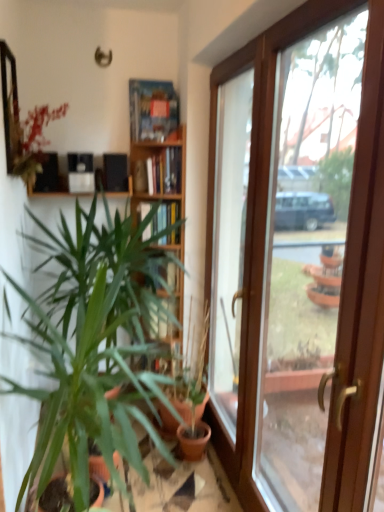
Question: Is matte black shelf at upper left closer to camera compared to clear glass door at center?

Choices:
 (A) no
 (B) yes

Answer: (A)

Question: Is matte black shelf at upper left with clear glass door at center?

Choices:
 (A) yes
 (B) no

Answer: (B)

Question: From the image's perspective, is matte black shelf at upper left beneath clear glass door at center?

Choices:
 (A) yes
 (B) no

Answer: (B)

Question: Can clear glass door at center be found inside matte black shelf at upper left?

Choices:
 (A) yes
 (B) no

Answer: (B)

Question: Is clear glass door at center at the back of matte black shelf at upper left?

Choices:
 (A) yes
 (B) no

Answer: (B)

Question: Are matte black shelf at upper left and clear glass door at center located far from each other?

Choices:
 (A) no
 (B) yes

Answer: (A)

Question: Would you say clear glass door at center contains matte black shelf at upper left?

Choices:
 (A) no
 (B) yes

Answer: (A)

Question: From the image's perspective, is clear glass door at center on top of matte black shelf at upper left?

Choices:
 (A) yes
 (B) no

Answer: (B)

Question: Is clear glass door at center facing away from matte black shelf at upper left?

Choices:
 (A) no
 (B) yes

Answer: (A)

Question: Does clear glass door at center come in front of matte black shelf at upper left?

Choices:
 (A) no
 (B) yes

Answer: (B)

Question: Is clear glass door at center further to the viewer compared to matte black shelf at upper left?

Choices:
 (A) no
 (B) yes

Answer: (A)

Question: Is clear glass door at center with matte black shelf at upper left?

Choices:
 (A) no
 (B) yes

Answer: (A)

Question: From a real-world perspective, is green matte plant at left, which ranks as the 2th houseplant in right-to-left order, on clear glass door at center?

Choices:
 (A) yes
 (B) no

Answer: (B)